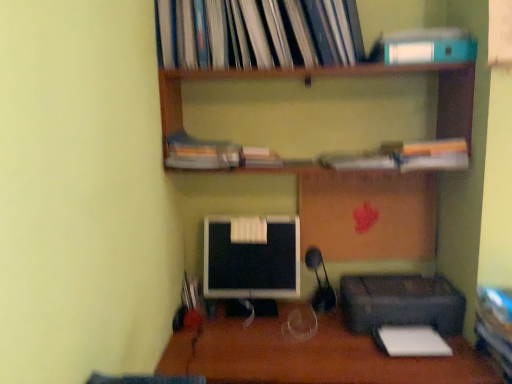
Find the location of `vacant region under teal matte paperback book at upper right (from a real-world perspective)`. vacant region under teal matte paperback book at upper right (from a real-world perspective) is located at coordinates (416, 66).